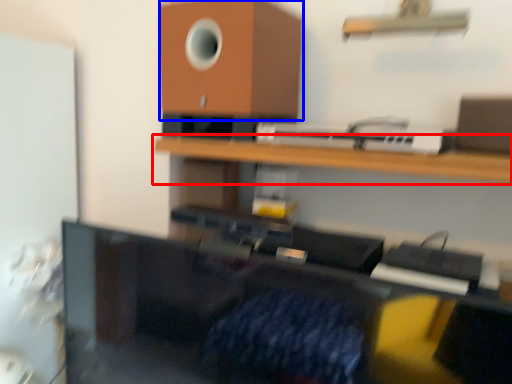
Question: Which object is closer to the camera taking this photo, shelf (highlighted by a red box) or speaker (highlighted by a blue box)?

Choices:
 (A) shelf
 (B) speaker

Answer: (A)